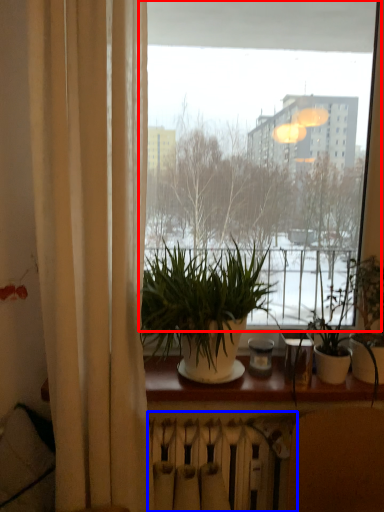
Question: Among these objects, which one is farthest to the camera, window (highlighted by a red box) or radiator (highlighted by a blue box)?

Choices:
 (A) window
 (B) radiator

Answer: (B)